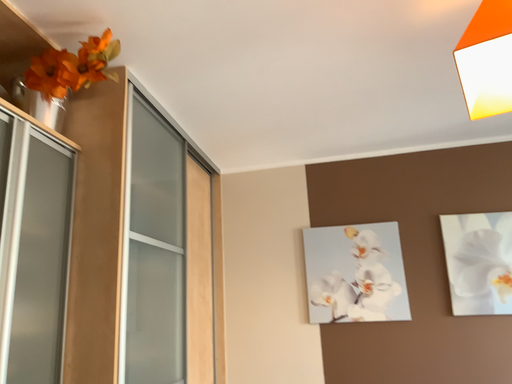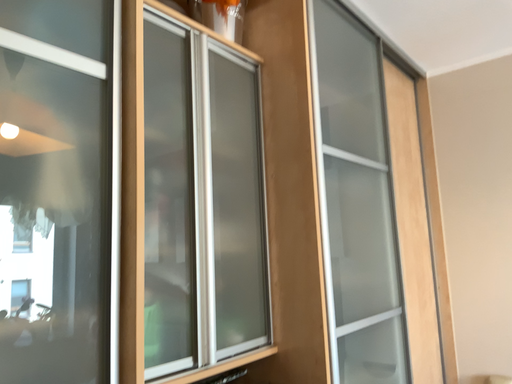
Question: Which way did the camera rotate in the video?

Choices:
 (A) rotated left
 (B) rotated right

Answer: (A)